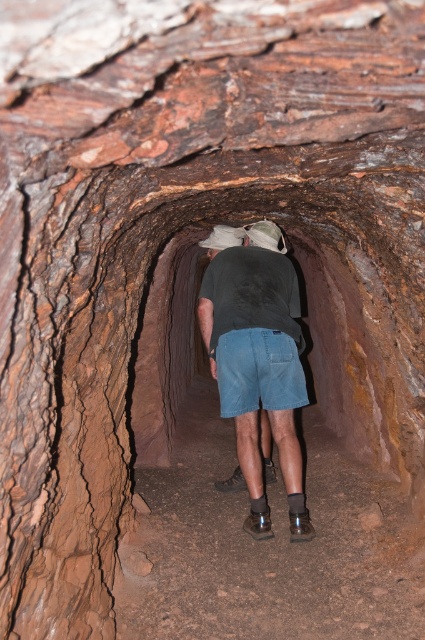
Does point (272, 380) lie behind point (303, 400)?

No, (272, 380) is in front of (303, 400).

Who is more forward, (243,356) or (255,404)?

Positioned in front is point (243,356).

Image resolution: width=425 pixels, height=640 pixels. In order to click on dark gray t-shirt at center in this screenshot , I will do `click(258, 362)`.